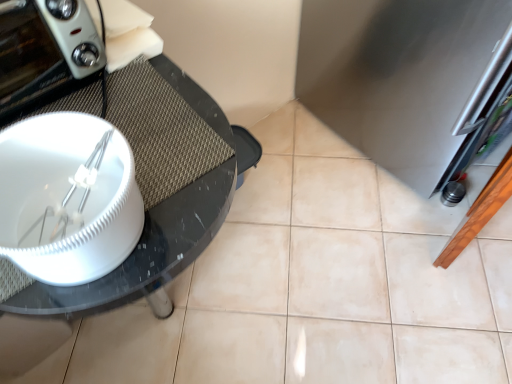
Question: Does black glossy glass table at left have a greater height compared to matte white toaster at left?

Choices:
 (A) yes
 (B) no

Answer: (B)

Question: Is black glossy glass table at left not close to matte white toaster at left?

Choices:
 (A) yes
 (B) no

Answer: (B)

Question: Is black glossy glass table at left behind matte white toaster at left?

Choices:
 (A) no
 (B) yes

Answer: (B)

Question: Considering the relative sizes of black glossy glass table at left and matte white toaster at left in the image provided, is black glossy glass table at left smaller than matte white toaster at left?

Choices:
 (A) no
 (B) yes

Answer: (B)

Question: Can you confirm if black glossy glass table at left is bigger than matte white toaster at left?

Choices:
 (A) no
 (B) yes

Answer: (A)

Question: Is point (474, 81) positioned closer to the camera than point (96, 104)?

Choices:
 (A) farther
 (B) closer

Answer: (A)

Question: Looking at their shapes, would you say stainless steel refrigerator at right is wider or thinner than black glossy glass table at left?

Choices:
 (A) wide
 (B) thin

Answer: (A)

Question: Which is correct: stainless steel refrigerator at right is inside black glossy glass table at left, or outside of it?

Choices:
 (A) outside
 (B) inside

Answer: (A)

Question: In the image, is stainless steel refrigerator at right on the left side or the right side of black glossy glass table at left?

Choices:
 (A) left
 (B) right

Answer: (B)

Question: Is point (134, 104) positioned closer to the camera than point (95, 44)?

Choices:
 (A) closer
 (B) farther

Answer: (B)

Question: From a real-world perspective, is black glossy glass table at left physically located above or below matte white toaster at left?

Choices:
 (A) above
 (B) below

Answer: (B)

Question: In terms of width, does black glossy glass table at left look wider or thinner when compared to matte white toaster at left?

Choices:
 (A) thin
 (B) wide

Answer: (B)

Question: Considering the positions of black glossy glass table at left and matte white toaster at left in the image, is black glossy glass table at left taller or shorter than matte white toaster at left?

Choices:
 (A) tall
 (B) short

Answer: (B)

Question: Does point (409, 135) appear closer or farther from the camera than point (10, 91)?

Choices:
 (A) farther
 (B) closer

Answer: (A)

Question: Is stainless steel refrigerator at right spatially inside matte white toaster at left, or outside of it?

Choices:
 (A) inside
 (B) outside

Answer: (B)